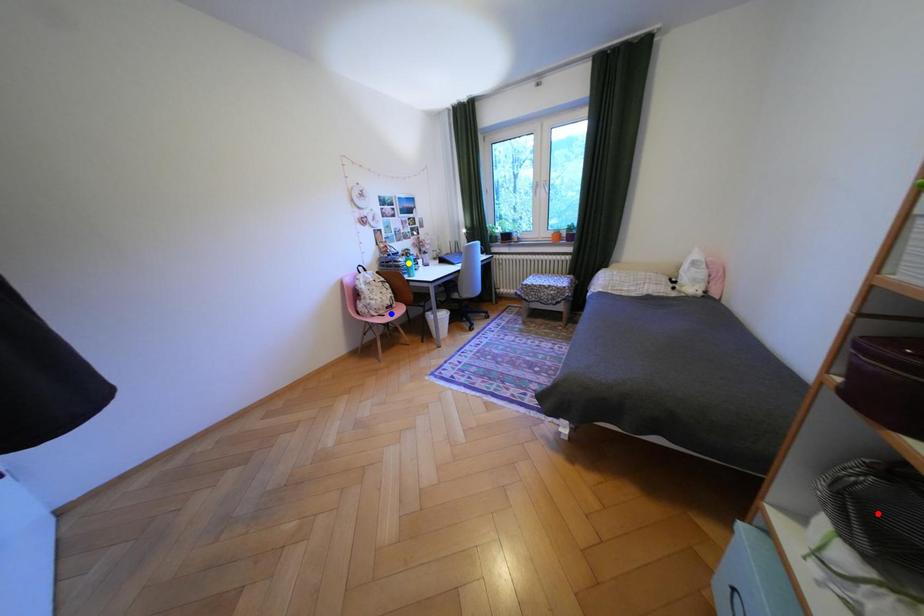
Order these from nearest to farthest:
blue point | red point | yellow point

red point → blue point → yellow point